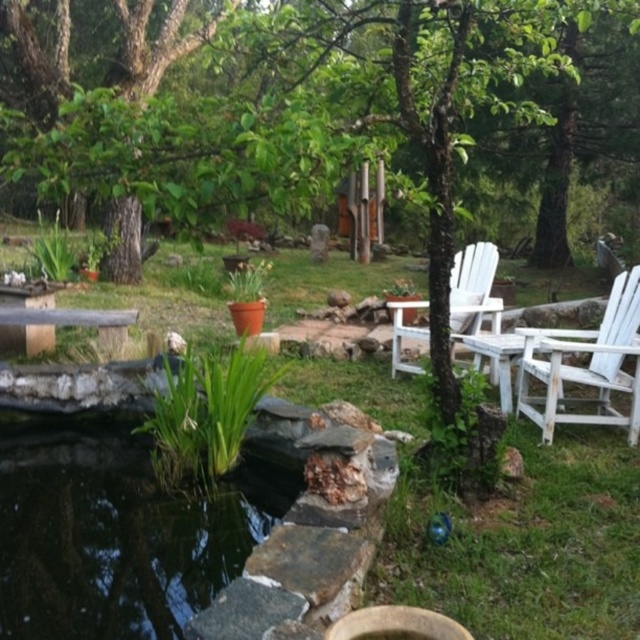
You are planning to place a new small statue in the garden. The statue is 1.2 meters tall. The green leafy plant at center and white wooden chair at right are already there. Can the statue be placed between them without blocking the view of the chair from the plant?

The green leafy plant at center is shorter than the white wooden chair at right. Since the statue is 1.2 meters tall, it depends on the height of the plant and chair. However, the description only states the plant is shorter than the chair but doesn

You are standing at the edge of the pond in the garden and want to walk to the orange pot. There is a point marked at coordinates (116, 532) on the green leafy plant at center. Is this point on your path to the orange pot?

The point marked at coordinates (116, 532) is on the green leafy plant at center, which is not mentioned in relation to the path to the orange pot. Since the orange pot is in the grassy area with scattered potted plants, the path might go around or near the green leafy plant, but without specific information about the path, we cannot confirm if the point is on the path.